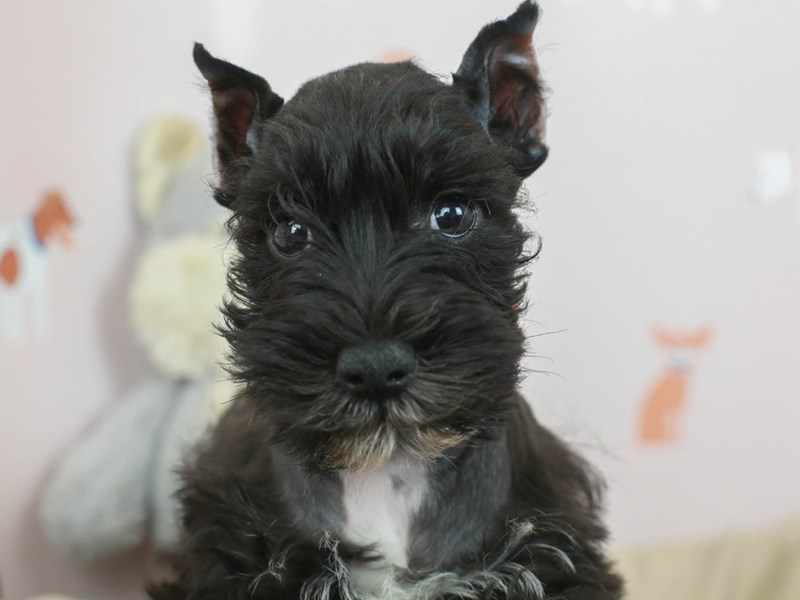
You are a GUI agent. You are given a task and a screenshot of the screen. Output one action in this format:
    pyautogui.click(x=<x>, y=<y>)
    Task: Click on the beige covering on bed
    The height and width of the screenshot is (600, 800).
    Given the screenshot: What is the action you would take?
    pyautogui.click(x=712, y=571)